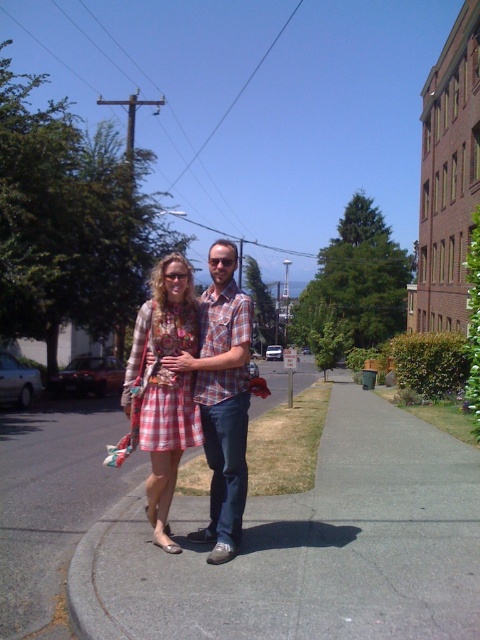
Question: Which of the following is the farthest from the observer?

Choices:
 (A) (142, 317)
 (B) (244, 483)

Answer: (A)

Question: Which object appears farthest from the camera in this image?

Choices:
 (A) gray asphalt sidewalk at center
 (B) floral-patterned dress at center

Answer: (B)

Question: Which point is farther to the camera?

Choices:
 (A) (189, 285)
 (B) (338, 372)
 (C) (233, 417)

Answer: (B)

Question: In this image, where is gray asphalt sidewalk at center located relative to plaid shirt at center?

Choices:
 (A) below
 (B) above

Answer: (A)

Question: In this image, where is plaid shirt at center located relative to floral-patterned dress at center?

Choices:
 (A) below
 (B) above

Answer: (A)

Question: Can you confirm if plaid shirt at center is positioned to the right of floral-patterned dress at center?

Choices:
 (A) yes
 (B) no

Answer: (A)